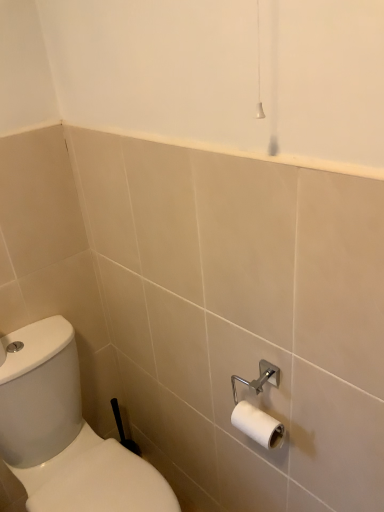
The width and height of the screenshot is (384, 512). Identify the location of white glossy toilet at lower left. (65, 432).

Describe the element at coordinates (65, 432) in the screenshot. I see `white glossy toilet at lower left` at that location.

What is the approximate width of white glossy toilet at lower left?

The width of white glossy toilet at lower left is 26.73 inches.

Locate an element on the screen. The image size is (384, 512). white glossy toilet at lower left is located at coordinates (65, 432).